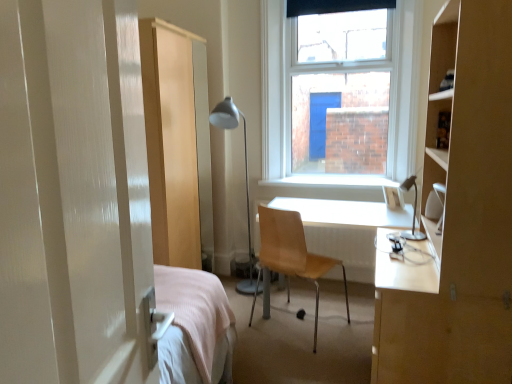
Question: In the image, is white glossy desk at center on the left side or the right side of matte silver floor lamp at center, the second table lamp in the front-to-back sequence?

Choices:
 (A) right
 (B) left

Answer: (A)

Question: Would you say white glossy desk at center is inside or outside matte silver floor lamp at center, which is the 2th table lamp from right to left?

Choices:
 (A) outside
 (B) inside

Answer: (A)

Question: Which of these objects is positioned closest to the white smooth window sill at center?

Choices:
 (A) matte silver floor lamp at center, which appears as the first table lamp when viewed from the left
 (B) matte silver table lamp at right, the 1th table lamp viewed from the right
 (C) white glossy desk at center
 (D) wooden chair at center

Answer: (C)

Question: Which object is positioned closest to the white smooth window sill at center?

Choices:
 (A) wooden chair at center
 (B) matte silver table lamp at right, the 1th table lamp viewed from the right
 (C) matte silver floor lamp at center, the second table lamp in the front-to-back sequence
 (D) white glossy desk at center

Answer: (D)